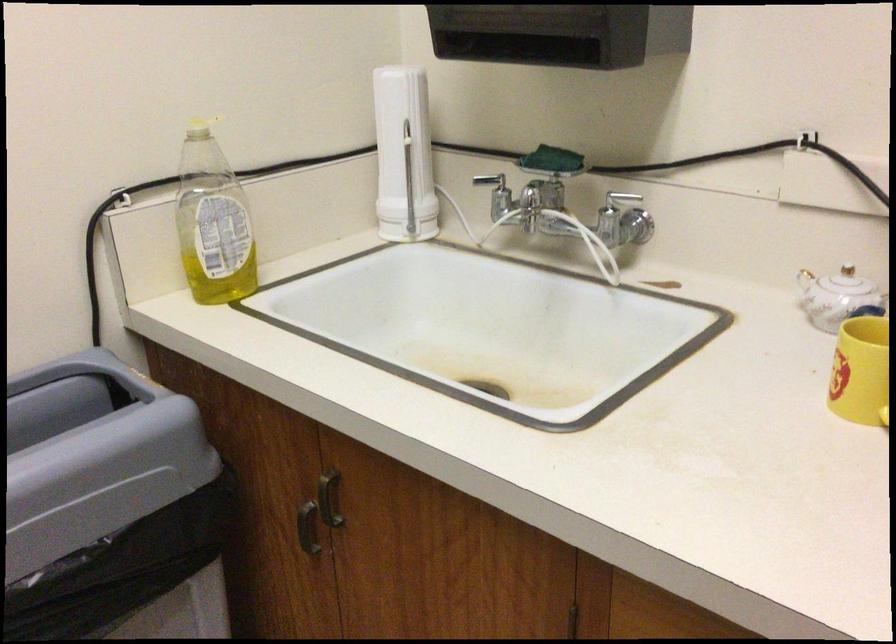
Describe the element at coordinates (848, 287) in the screenshot. I see `a teapot lid knob` at that location.